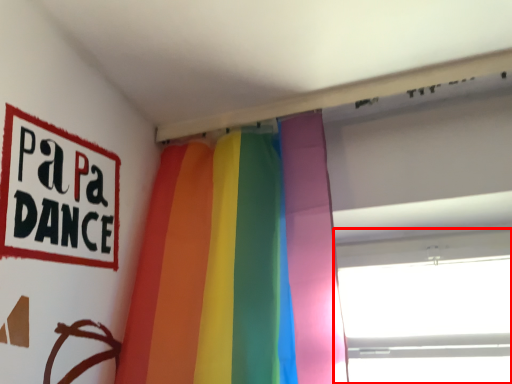
Question: Considering the relative positions of window (annotated by the red box) and curtain in the image provided, where is window (annotated by the red box) located with respect to the staircase?

Choices:
 (A) right
 (B) left

Answer: (A)